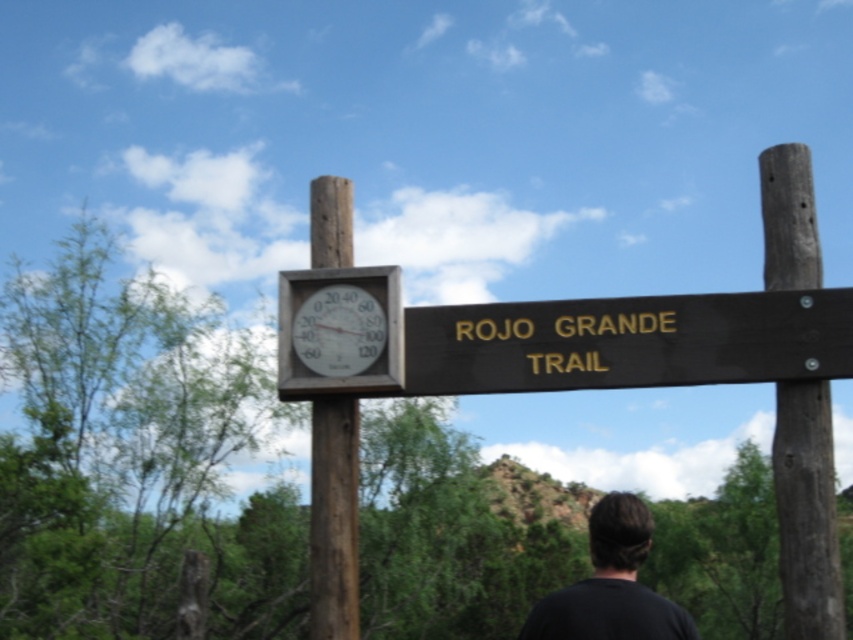
You are a hiker approaching the brown wood post at right and the white plastic clock at upper center. Which object will you encounter first as you walk towards them?

The brown wood post at right is closer to you than the white plastic clock at upper center, so you will encounter the brown wood post at right first.